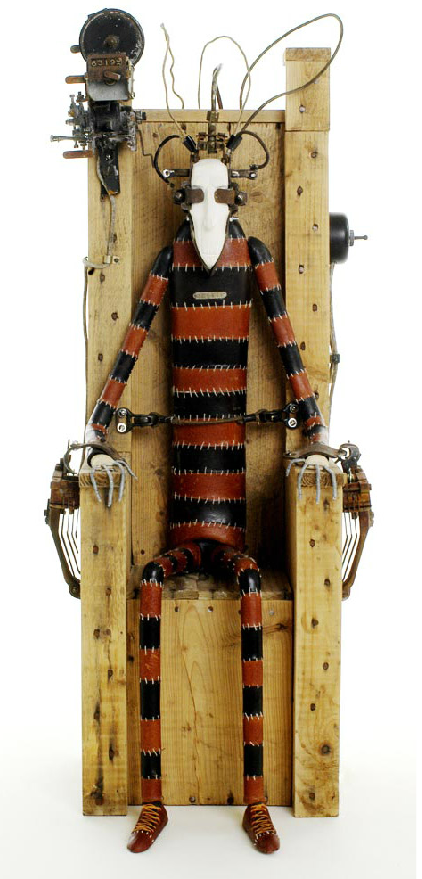
What are the coordinates of `backrest` in the screenshot? It's located at (261, 200).